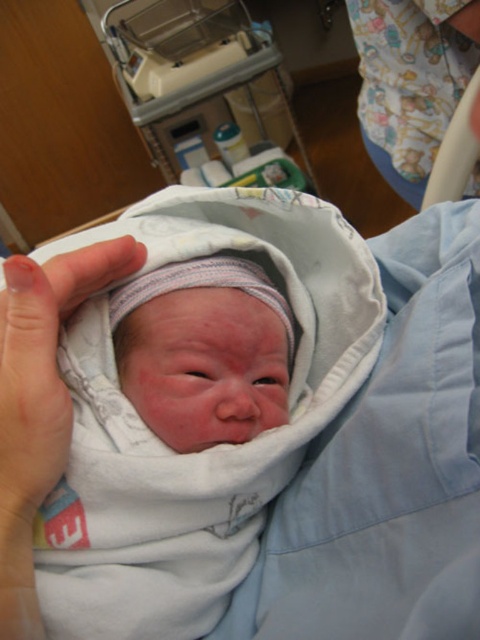
Question: Does smooth white swaddle at center come in front of pink flesh at center?

Choices:
 (A) yes
 (B) no

Answer: (B)

Question: In this image, where is smooth white swaddle at center located relative to pink flesh at center?

Choices:
 (A) right
 (B) left

Answer: (A)

Question: Among these points, which one is farthest from the camera?

Choices:
 (A) (146, 298)
 (B) (61, 429)

Answer: (A)

Question: Is smooth white swaddle at center wider than pink flesh at center?

Choices:
 (A) no
 (B) yes

Answer: (B)